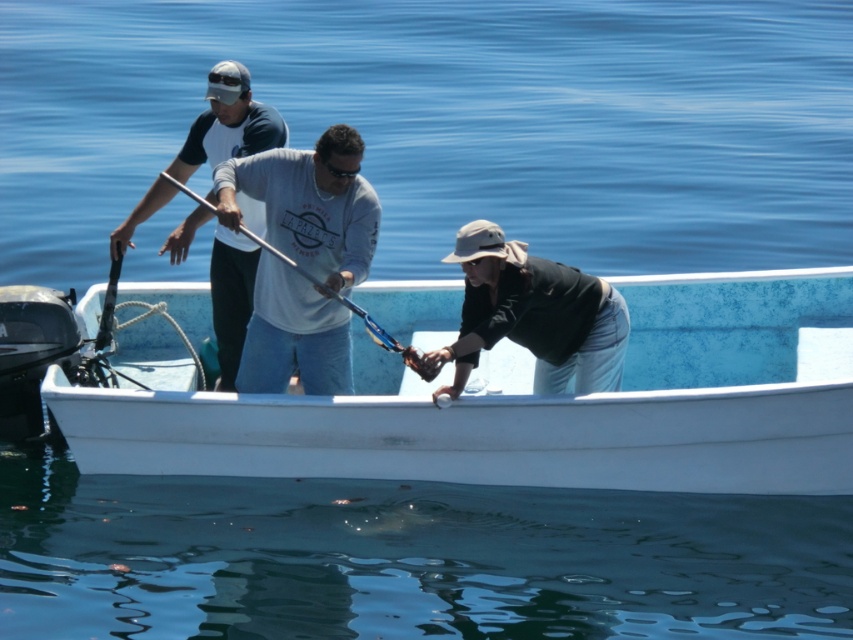
Image resolution: width=853 pixels, height=640 pixels. What are the coordinates of `khaki fabric hat at center` in the screenshot? It's located at (531, 316).

From the picture: Does khaki fabric hat at center have a lesser width compared to matte white shirt at center?

No, khaki fabric hat at center is not thinner than matte white shirt at center.

Does point (543, 371) lie behind point (218, 266)?

No.

Image resolution: width=853 pixels, height=640 pixels. Identify the location of khaki fabric hat at center. (531, 316).

Between white matte boat at center and metallic blue paddle at center, which one has less height?

With less height is white matte boat at center.

Who is more forward, [271,445] or [283,257]?

Point [283,257]

Who is more forward, (830, 456) or (369, 326)?

Point (369, 326) is more forward.

This screenshot has width=853, height=640. In order to click on white matte boat at center in this screenshot , I will do `click(524, 404)`.

Is white matte boat at center wider than khaki fabric hat at center?

Yes.

Is white matte boat at center above khaki fabric hat at center?

Actually, white matte boat at center is below khaki fabric hat at center.

The image size is (853, 640). In order to click on white matte boat at center in this screenshot , I will do `click(524, 404)`.